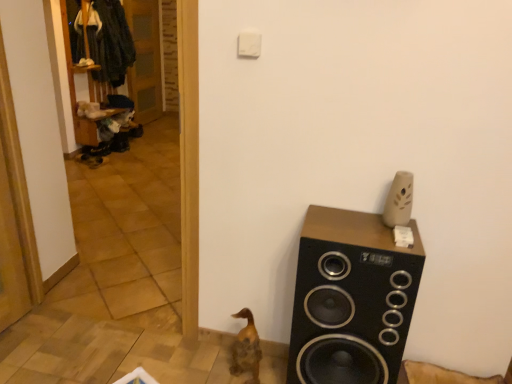
Question: Based on their positions, is brown wooden duck at lower center located to the left or right of black matte speaker at right?

Choices:
 (A) right
 (B) left

Answer: (B)

Question: From a real-world perspective, relative to black matte speaker at right, is brown wooden duck at lower center vertically above or below?

Choices:
 (A) above
 (B) below

Answer: (B)

Question: Which object is positioned farthest from the black matte speaker at right?

Choices:
 (A) brown wooden duck at lower center
 (B) wooden at left

Answer: (B)

Question: Which object is positioned farthest from the brown wooden duck at lower center?

Choices:
 (A) black matte speaker at right
 (B) wooden at left

Answer: (B)